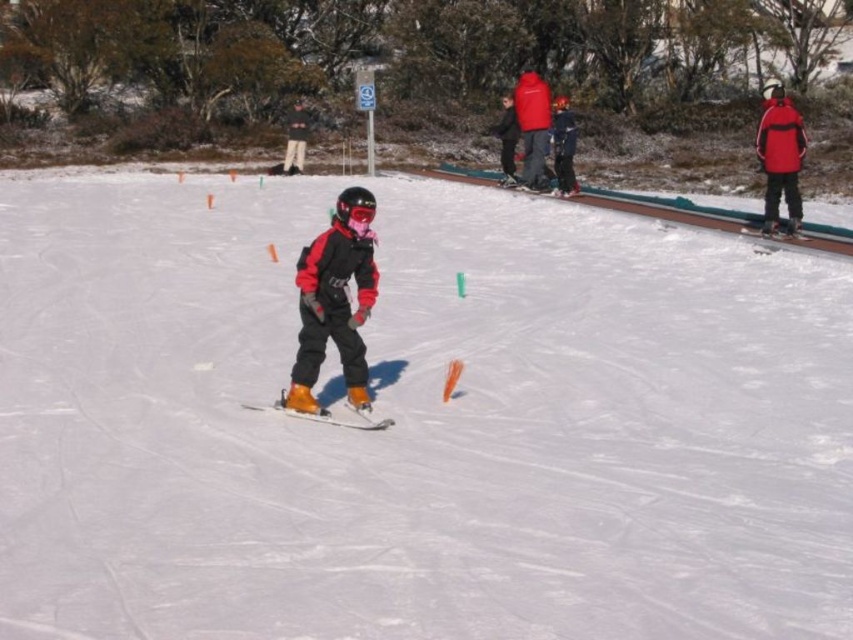
You are standing at the bottom of the slope and see the white matte snow at center and the matte red jacket at upper center. Which object is closer to your current position?

The white matte snow at center is closer to your current position because it is to the left of the matte red jacket at upper center, indicating it is nearer in the frame.

You are a photographer trying to capture a clear shot of the matte black snowboard at center and the matte black jacket at center. Since both are matte black, you want to ensure they are distinguishable in the photo. Which object will appear smaller in your photo?

The matte black snowboard at center appears smaller in the photo because it occupies less space than the matte black jacket at center.

You are the child skiing down the slope and want to reach the bottom as quickly as possible. You notice two points marked on your path. Which point should you aim for first, point 1 at coordinates (x=366, y=392) or point 2 at coordinates (x=564, y=168)?

You should aim for point 1 at coordinates (x=366, y=392) first because it is in front of point 2 at coordinates (x=564, y=168) along your path.